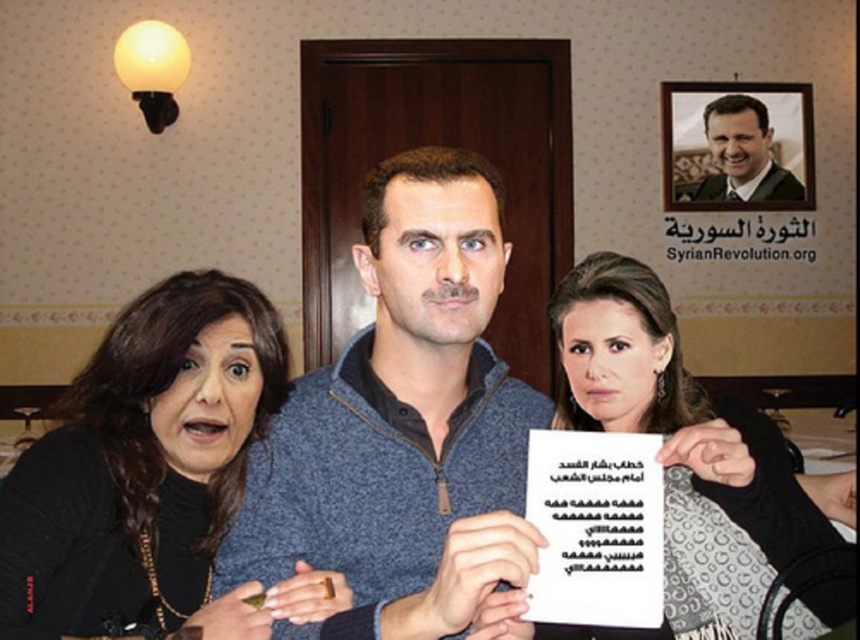
Does black matte hair at left appear on the right side of smooth black suit at upper right?

Incorrect, black matte hair at left is not on the right side of smooth black suit at upper right.

Measure the distance from black matte hair at left to smooth black suit at upper right.

black matte hair at left and smooth black suit at upper right are 3.44 meters apart.

Does point (220, 500) come behind point (717, 108)?

That is False.

Find the location of a particular element. The width and height of the screenshot is (860, 640). black matte hair at left is located at coordinates (130, 472).

Can you confirm if blue knitted sweater at center is smaller than smooth black suit at upper right?

Incorrect, blue knitted sweater at center is not smaller in size than smooth black suit at upper right.

Is blue knitted sweater at center closer to the viewer compared to smooth black suit at upper right?

Yes, it is in front of smooth black suit at upper right.

Does point (317, 564) come behind point (754, 140)?

No, it is in front of (754, 140).

Identify the location of blue knitted sweater at center. coord(403,426).

Does black matte hair at left have a larger size compared to matte black dress at center?

No.

Is black matte hair at left below matte black dress at center?

No, black matte hair at left is not below matte black dress at center.

Between point (215, 524) and point (568, 634), which one is positioned behind?

The point (215, 524) is more distant.

What are the coordinates of `black matte hair at left` in the screenshot? It's located at (130, 472).